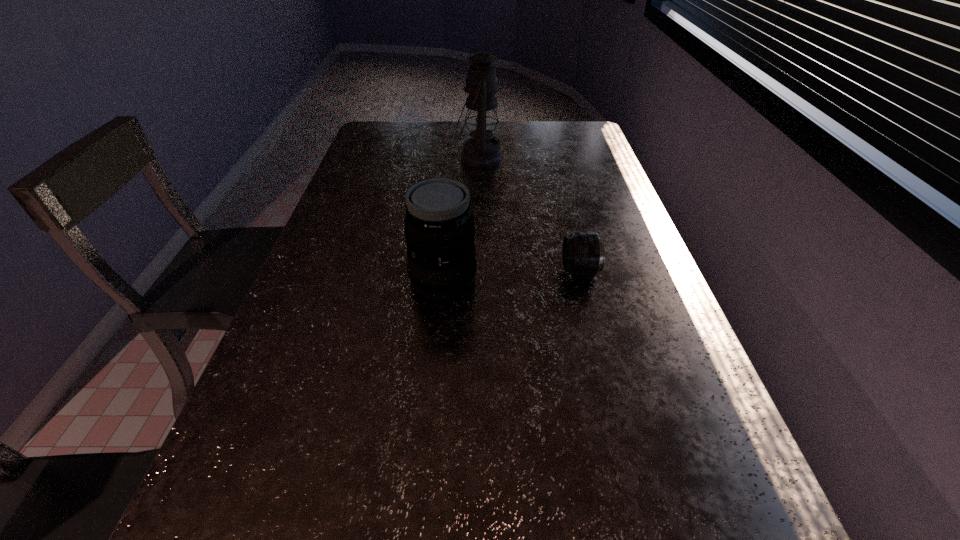
This screenshot has height=540, width=960. I want to click on free space between the shorter telephoto lens and the oil lamp, so click(x=530, y=214).

At what (x,y) coordinates should I click in order to perform the action: click on free space between the farthest object and the rightmost object. Please return your answer as a coordinate pair (x, y). Looking at the image, I should click on (530, 214).

At what (x,y) coordinates should I click in order to perform the action: click on vacant point located between the shortest object and the taller telephoto lens. Please return your answer as a coordinate pair (x, y). Image resolution: width=960 pixels, height=540 pixels. Looking at the image, I should click on (512, 275).

Image resolution: width=960 pixels, height=540 pixels. I want to click on unoccupied position between the rightmost object and the left telephoto lens, so click(x=512, y=275).

Identify the location of unoccupied position between the taller telephoto lens and the rightmost object. This screenshot has width=960, height=540. (512, 275).

You are a GUI agent. You are given a task and a screenshot of the screen. Output one action in this format:
    pyautogui.click(x=<x>, y=<y>)
    Task: Click on the free space between the shorter telephoto lens and the taller telephoto lens
    The image size is (960, 540).
    Given the screenshot: What is the action you would take?
    pyautogui.click(x=512, y=275)

Where is `object identified as the second closest to the shorter telephoto lens`? object identified as the second closest to the shorter telephoto lens is located at coordinates (482, 150).

Locate an element on the screen. This screenshot has width=960, height=540. object that is the closest to the oil lamp is located at coordinates (439, 229).

The width and height of the screenshot is (960, 540). What are the coordinates of `blank space that satisfies the following two spatial constraints: 1. at the front element of the right telephoto lens; 2. on the front side of the taller telephoto lens` in the screenshot? It's located at (582, 280).

Where is `vacant space that satisfies the following two spatial constraints: 1. at the front element of the rightmost object; 2. on the front side of the left telephoto lens`? vacant space that satisfies the following two spatial constraints: 1. at the front element of the rightmost object; 2. on the front side of the left telephoto lens is located at coordinates (582, 280).